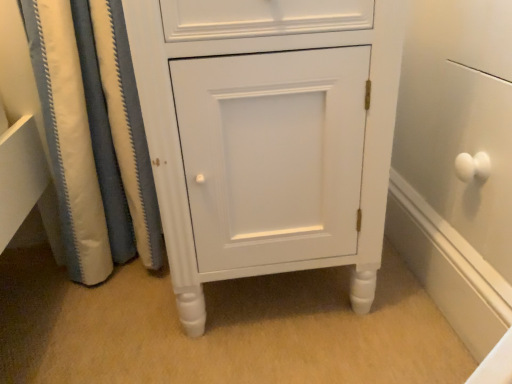
This screenshot has width=512, height=384. What do you see at coordinates (268, 135) in the screenshot? I see `white matte cabinet at center` at bounding box center [268, 135].

Locate an element on the screen. white matte cabinet at center is located at coordinates point(268,135).

The width and height of the screenshot is (512, 384). In order to click on white matte cabinet at center in this screenshot , I will do `click(268, 135)`.